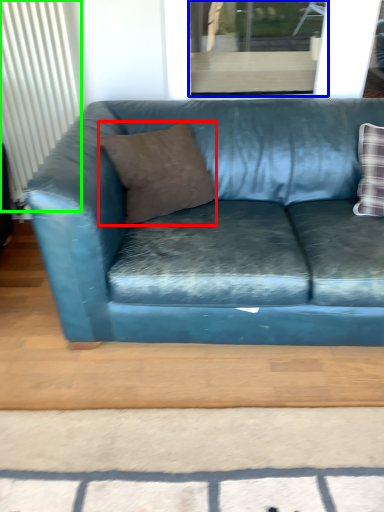
Question: Which object is positioned closest to pillow (highlighted by a red box)? Select from window (highlighted by a blue box) and radiator (highlighted by a green box).

Choices:
 (A) window
 (B) radiator

Answer: (B)